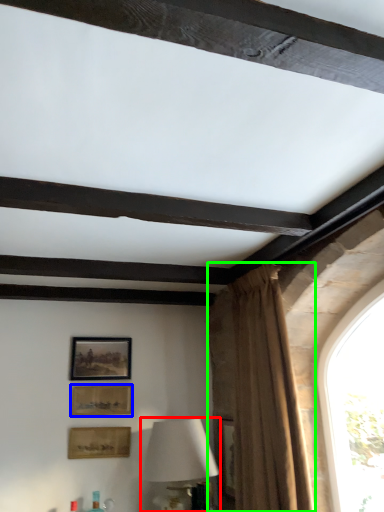
Question: Estimate the real-world distances between objects in this image. Which object is closer to table lamp (highlighted by a red box), picture frame (highlighted by a blue box) or curtain (highlighted by a green box)?

Choices:
 (A) picture frame
 (B) curtain

Answer: (A)